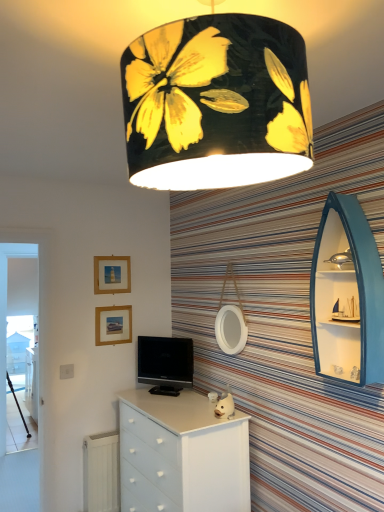
This screenshot has height=512, width=384. I want to click on vacant point above white matte radiator at lower left (from a real-world perspective), so click(102, 433).